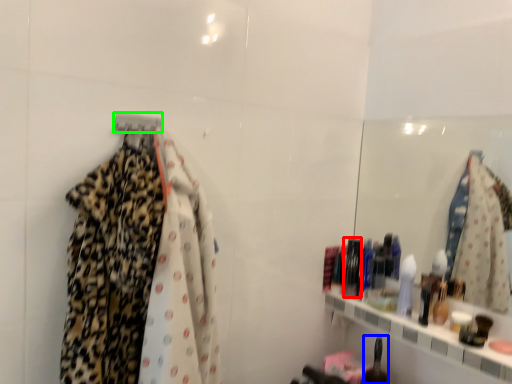
Question: Which object is positioned closest to toiletry (highlighted by a red box)? Select from toiletry (highlighted by a blue box) and hanger (highlighted by a green box).

Choices:
 (A) toiletry
 (B) hanger

Answer: (A)